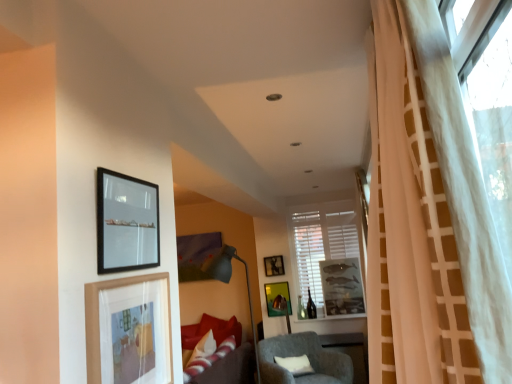
Question: Relative to matte gray floor lamp at center, is white sheer curtain at right in front or behind?

Choices:
 (A) behind
 (B) front

Answer: (B)

Question: Considering the positions of white sheer curtain at right and matte gray floor lamp at center in the image, is white sheer curtain at right wider or thinner than matte gray floor lamp at center?

Choices:
 (A) thin
 (B) wide

Answer: (A)

Question: Considering the real-world distances, which object is closest to the white matte window at center?

Choices:
 (A) wooden textured picture frame at center, the third picture frame viewed from the front
 (B) gray fabric chair at center
 (C) wooden picture frame at lower left, acting as the 1th picture frame starting from the front
 (D) matte black picture frame at upper center, the 3th picture frame in the left-to-right sequence
 (E) metallic gold picture frame at center, the 4th picture frame from the front

Answer: (A)

Question: Which of these objects is positioned farthest from the metallic gold picture frame at center, which is the second picture frame in back-to-front order?

Choices:
 (A) matte gray floor lamp at center
 (B) white sheer curtain at right
 (C) matte black picture frame at upper center, which appears as the 5th picture frame when viewed from the front
 (D) white matte window at center
 (E) wooden picture frame at lower left, placed as the 4th picture frame when sorted from right to left

Answer: (B)